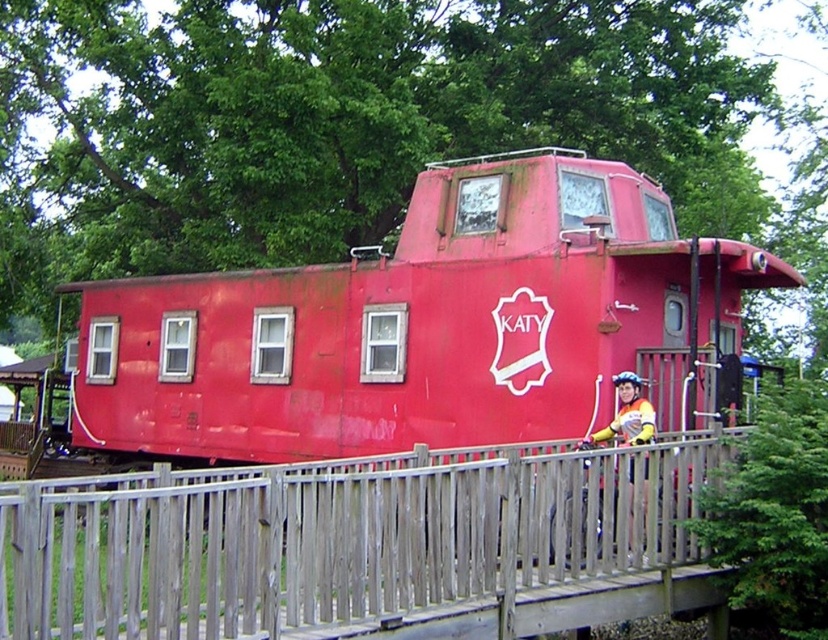
Does point (282, 452) come behind point (49, 513)?

Yes, point (282, 452) is behind point (49, 513).

Locate an element on the screen. This screenshot has width=828, height=640. rusty red caboose at center is located at coordinates (417, 324).

In order to click on rusty red caboose at center in this screenshot , I will do `click(417, 324)`.